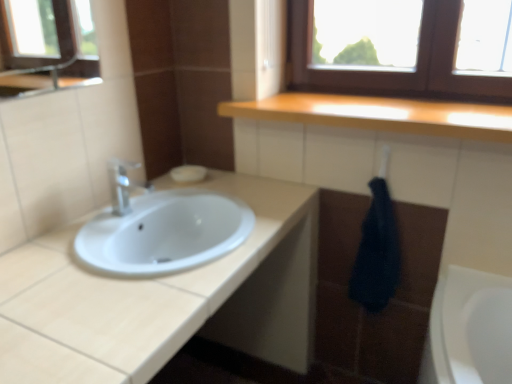
Question: Is dark blue towel at lower right to the right of white matte soap at center from the viewer's perspective?

Choices:
 (A) yes
 (B) no

Answer: (A)

Question: Is dark blue towel at lower right closer to camera compared to white matte soap at center?

Choices:
 (A) yes
 (B) no

Answer: (A)

Question: From the image's perspective, is dark blue towel at lower right above white matte soap at center?

Choices:
 (A) no
 (B) yes

Answer: (A)

Question: From a real-world perspective, is dark blue towel at lower right on white matte soap at center?

Choices:
 (A) yes
 (B) no

Answer: (B)

Question: Does dark blue towel at lower right have a greater width compared to white matte soap at center?

Choices:
 (A) yes
 (B) no

Answer: (B)

Question: Considering the positions of white glossy sink at center and satin nickel faucet at left in the image, is white glossy sink at center bigger or smaller than satin nickel faucet at left?

Choices:
 (A) small
 (B) big

Answer: (B)

Question: Is white glossy sink at center wider or thinner than satin nickel faucet at left?

Choices:
 (A) wide
 (B) thin

Answer: (A)

Question: From a real-world perspective, is white glossy sink at center physically located above or below satin nickel faucet at left?

Choices:
 (A) above
 (B) below

Answer: (B)

Question: Considering the positions of white glossy sink at center and satin nickel faucet at left in the image, is white glossy sink at center taller or shorter than satin nickel faucet at left?

Choices:
 (A) tall
 (B) short

Answer: (B)

Question: Is white glossy sink at center to the left or to the right of dark blue towel at lower right in the image?

Choices:
 (A) right
 (B) left

Answer: (B)

Question: Considering the positions of white glossy sink at center and dark blue towel at lower right in the image, is white glossy sink at center wider or thinner than dark blue towel at lower right?

Choices:
 (A) wide
 (B) thin

Answer: (A)

Question: Is white glossy sink at center inside the boundaries of dark blue towel at lower right, or outside?

Choices:
 (A) inside
 (B) outside

Answer: (B)

Question: From the image's perspective, is white glossy sink at center positioned above or below dark blue towel at lower right?

Choices:
 (A) above
 (B) below

Answer: (A)

Question: Would you say white matte soap at center is inside or outside satin nickel faucet at left?

Choices:
 (A) outside
 (B) inside

Answer: (A)

Question: Is point (196, 170) closer or farther from the camera than point (108, 165)?

Choices:
 (A) closer
 (B) farther

Answer: (B)